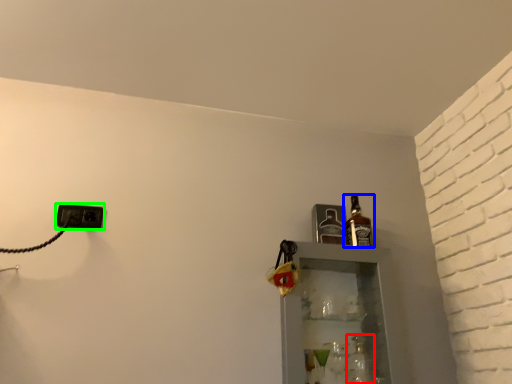
Question: Estimate the real-world distances between objects in this image. Which object is farther from bottle (highlighted by a red box), bottle (highlighted by a blue box) or electric outlet (highlighted by a green box)?

Choices:
 (A) bottle
 (B) electric outlet

Answer: (B)